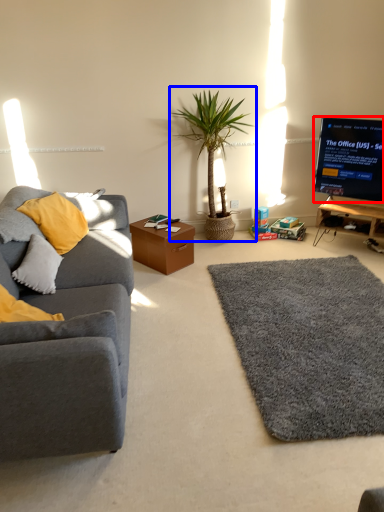
Question: Which object appears farthest to the camera in this image, television (highlighted by a red box) or houseplant (highlighted by a blue box)?

Choices:
 (A) television
 (B) houseplant

Answer: (A)